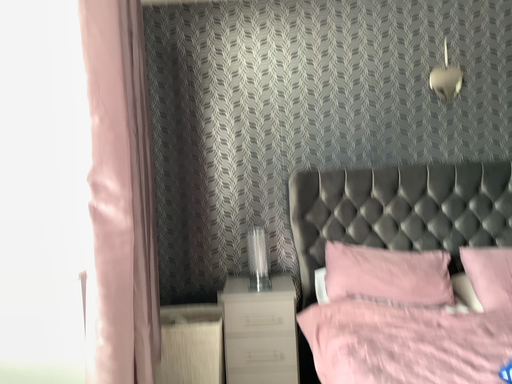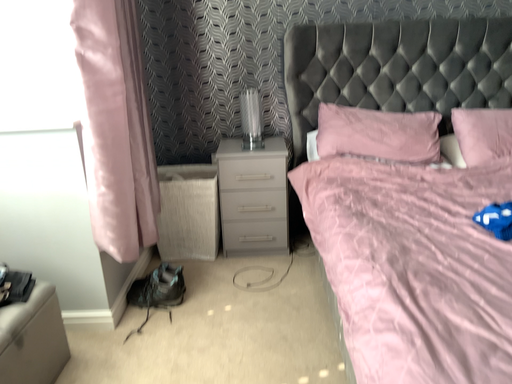
Question: Which way did the camera rotate in the video?

Choices:
 (A) rotated upward
 (B) rotated downward

Answer: (B)